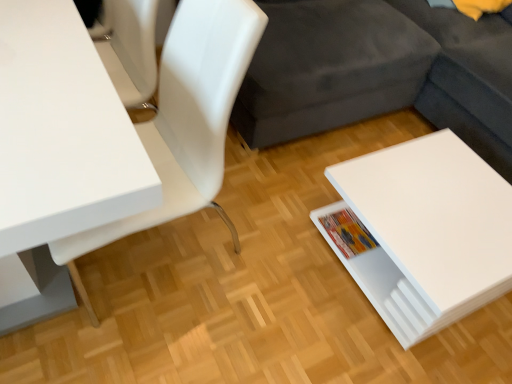
Question: Can you confirm if white glossy chair at upper left is shorter than white glossy table at lower right, marked as the 2th table in a left-to-right arrangement?

Choices:
 (A) yes
 (B) no

Answer: (B)

Question: Can you confirm if white glossy chair at upper left is wider than white glossy table at lower right, marked as the 2th table in a left-to-right arrangement?

Choices:
 (A) no
 (B) yes

Answer: (B)

Question: Is white glossy table at lower right, marked as the 2th table in a left-to-right arrangement, inside white glossy chair at upper left?

Choices:
 (A) no
 (B) yes

Answer: (A)

Question: From a real-world perspective, is white glossy chair at upper left located higher than white glossy table at lower right, marked as the 2th table in a left-to-right arrangement?

Choices:
 (A) yes
 (B) no

Answer: (A)

Question: From a real-world perspective, is white glossy chair at upper left under white glossy table at lower right, the first table from the right?

Choices:
 (A) yes
 (B) no

Answer: (B)

Question: Considering the relative positions of white glossy chair at upper left and white glossy table at lower right, the first table from the right, in the image provided, is white glossy chair at upper left to the left of white glossy table at lower right, the first table from the right, from the viewer's perspective?

Choices:
 (A) yes
 (B) no

Answer: (A)

Question: Does multicolored paper book at lower right have a greater height compared to white glossy table at lower right, the first table from the right?

Choices:
 (A) yes
 (B) no

Answer: (B)

Question: From the image's perspective, is multicolored paper book at lower right above white glossy table at lower right, the first table from the right?

Choices:
 (A) no
 (B) yes

Answer: (B)

Question: Does multicolored paper book at lower right turn towards white glossy table at lower right, marked as the 2th table in a left-to-right arrangement?

Choices:
 (A) no
 (B) yes

Answer: (B)

Question: Is multicolored paper book at lower right not inside white glossy table at lower right, marked as the 2th table in a left-to-right arrangement?

Choices:
 (A) yes
 (B) no

Answer: (B)

Question: Is white glossy table at lower right, the first table from the right, at the back of multicolored paper book at lower right?

Choices:
 (A) no
 (B) yes

Answer: (B)

Question: From the image's perspective, is multicolored paper book at lower right below white glossy table at lower right, the first table from the right?

Choices:
 (A) no
 (B) yes

Answer: (A)

Question: Can you confirm if white glossy table at lower right, the first table from the right, is positioned to the right of multicolored paper book at lower right?

Choices:
 (A) yes
 (B) no

Answer: (A)